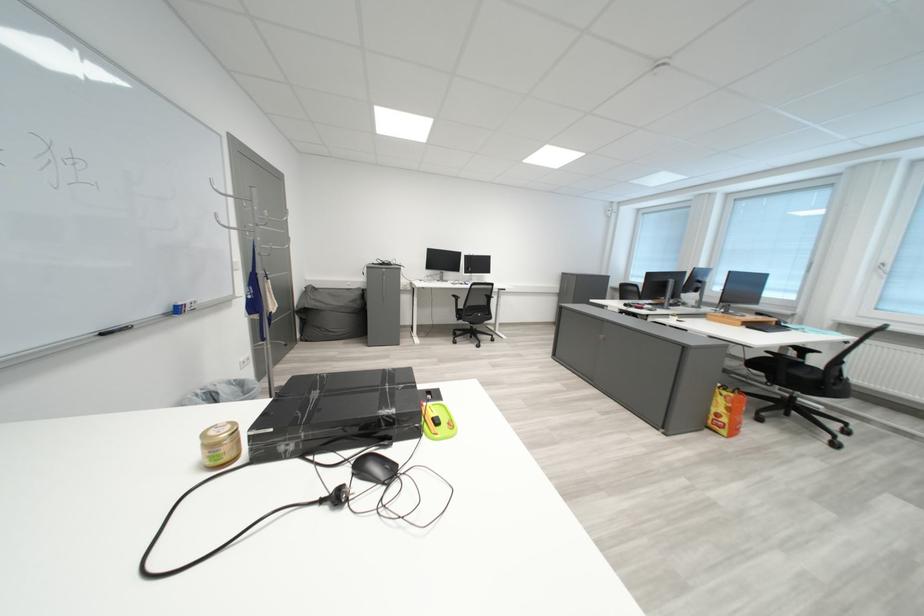
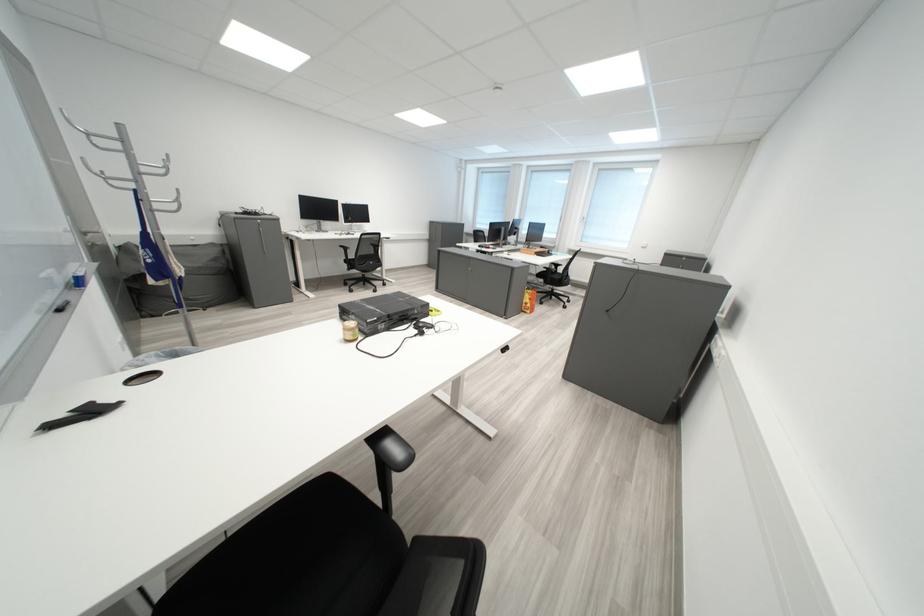
Question: Based on the continuous images, in which direction is the camera rotating? Reply with the corresponding letter.

Choices:
 (A) Left
 (B) Right
 (C) Up
 (D) Down

Answer: (B)